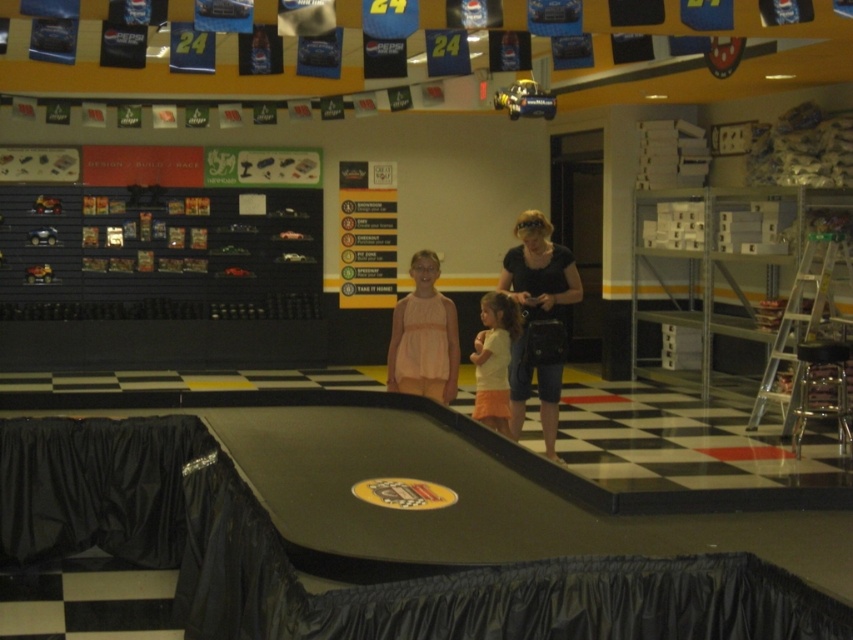
You are a customer in a NASCAR themed store and see a black fabric purse at center and a pink fabric dress at center. Which item is wider?

The black fabric purse at center might be wider than the pink fabric dress at center according to the description.